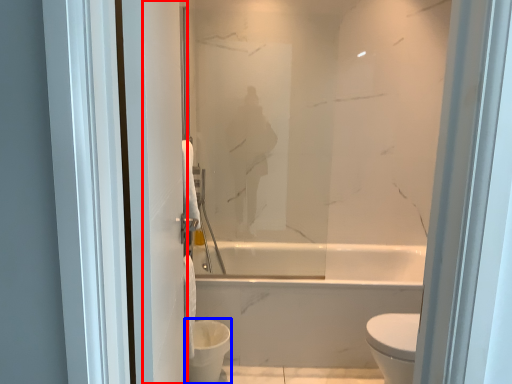
Question: Which object appears closest to the camera in this image, screen door (highlighted by a red box) or toilet bowl (highlighted by a blue box)?

Choices:
 (A) screen door
 (B) toilet bowl

Answer: (A)